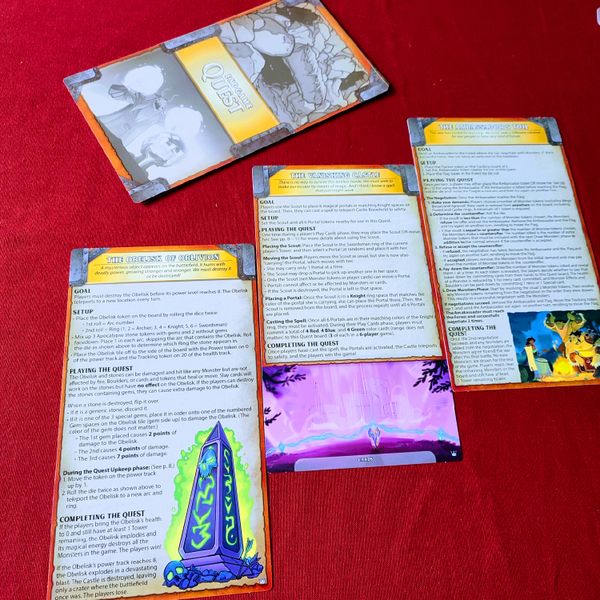
Find the location of a particular element. The image size is (600, 600). cloth is located at coordinates (48, 212).